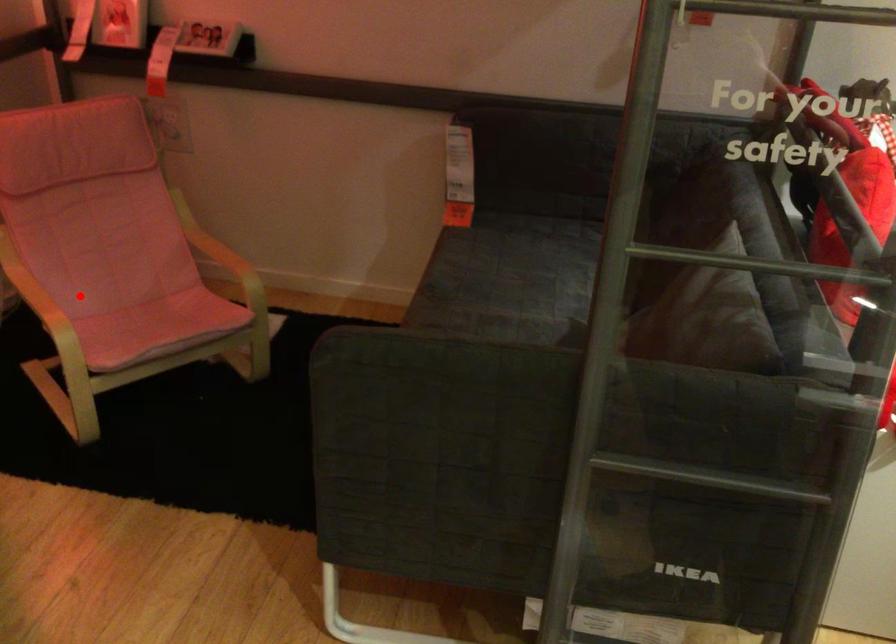
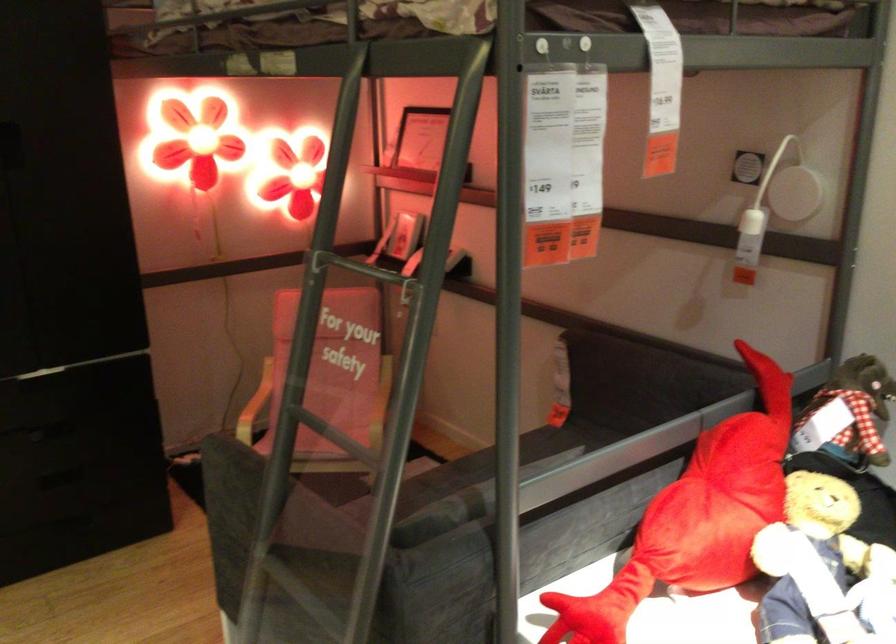
Question: I am providing you with two images of the same scene from different viewpoints. A red point is shown in image1. For the corresponding object point in image2, is it positioned nearer or farther from the camera?

Choices:
 (A) Nearer
 (B) Farther

Answer: (B)